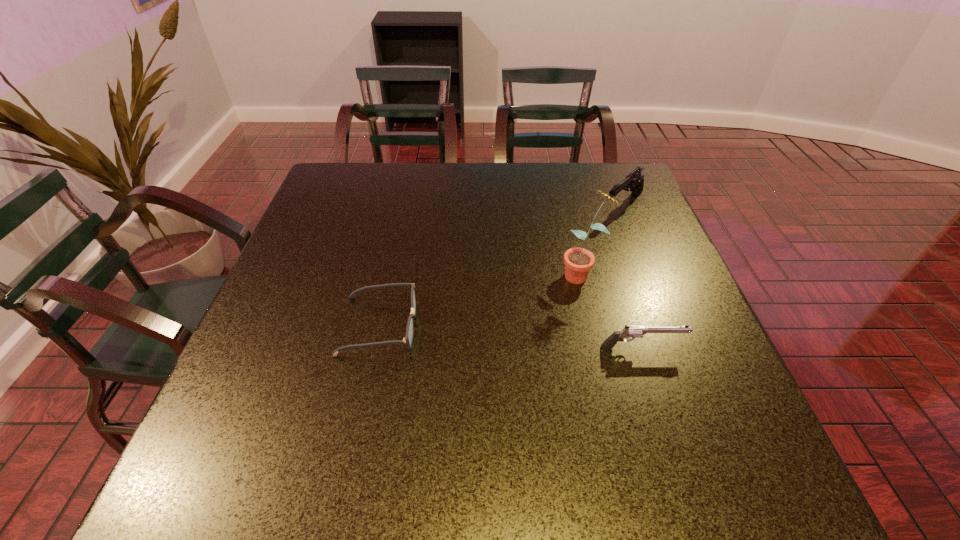
The height and width of the screenshot is (540, 960). In order to click on empty space that is in between the second shortest object and the farthest object in this screenshot , I will do `click(633, 276)`.

Find the location of a particular element. The height and width of the screenshot is (540, 960). vacant space in between the third tallest object and the tallest object is located at coordinates point(612,310).

You are a GUI agent. You are given a task and a screenshot of the screen. Output one action in this format:
    pyautogui.click(x=<x>, y=<y>)
    Task: Click on the free spot between the third tallest object and the tallest object
    
    Given the screenshot: What is the action you would take?
    [x=612, y=310]

Locate an element on the screen. The width and height of the screenshot is (960, 540). blank region between the leftmost object and the second shortest object is located at coordinates (511, 336).

At what (x,y) coordinates should I click in order to perform the action: click on free space between the third tallest object and the shortest object. Please return your answer as a coordinate pair (x, y). Looking at the image, I should click on (511, 336).

I want to click on free point between the farthest object and the pistol, so click(633, 276).

You are a GUI agent. You are given a task and a screenshot of the screen. Output one action in this format:
    pyautogui.click(x=<x>, y=<y>)
    Task: Click on the free space between the second farthest object and the leftmost object
    This screenshot has width=960, height=540.
    Given the screenshot: What is the action you would take?
    pyautogui.click(x=481, y=299)

This screenshot has height=540, width=960. I want to click on object that is the closest to the third nearest object, so click(x=634, y=181).

Choose which object is the second nearest neighbor to the shortest object. Please provide its 2D coordinates. Your answer should be formatted as a tuple, i.e. [(x, y)], where the tuple contains the x and y coordinates of a point satisfying the conditions above.

[(628, 331)]

This screenshot has width=960, height=540. In order to click on free spot that satisfies the following two spatial constraints: 1. on the back side of the second tallest object; 2. on the left side of the second farthest object in this screenshot , I will do `click(565, 205)`.